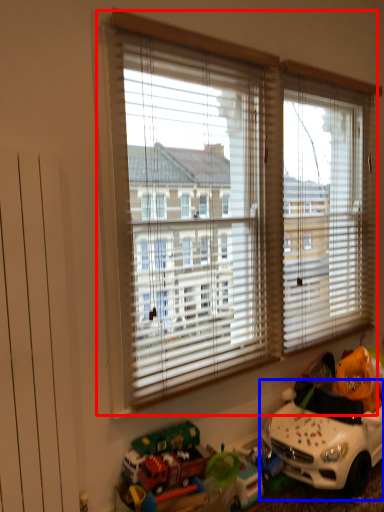
Question: Which point is further to the camera, window (highlighted by a red box) or toy (highlighted by a blue box)?

Choices:
 (A) window
 (B) toy

Answer: (B)